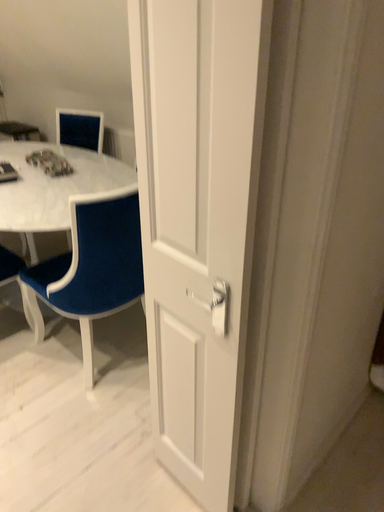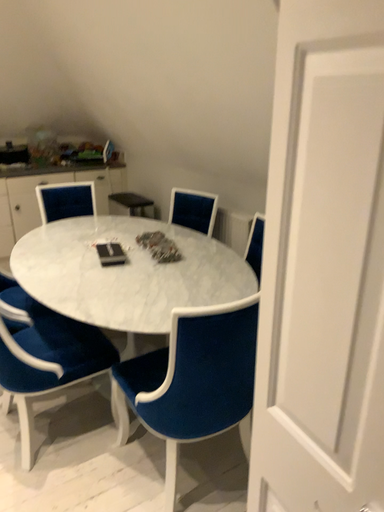
Question: How did the camera likely rotate when shooting the video?

Choices:
 (A) rotated upward
 (B) rotated downward

Answer: (A)